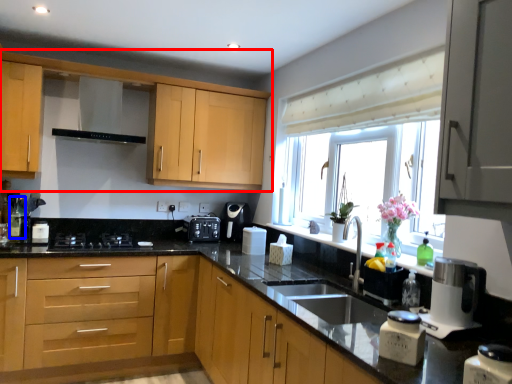
Question: Which point is closer to the camera, cabinetry (highlighted by a red box) or bottle (highlighted by a blue box)?

Choices:
 (A) cabinetry
 (B) bottle

Answer: (A)